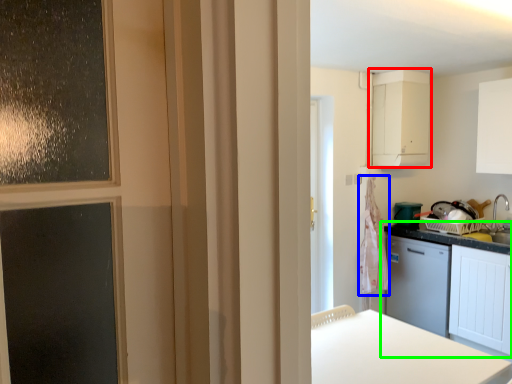
Question: Based on their relative distances, which object is nearer to cabinetry (highlighted by a red box)? Choose from laundry (highlighted by a blue box) and cabinetry (highlighted by a green box).

Choices:
 (A) laundry
 (B) cabinetry

Answer: (A)